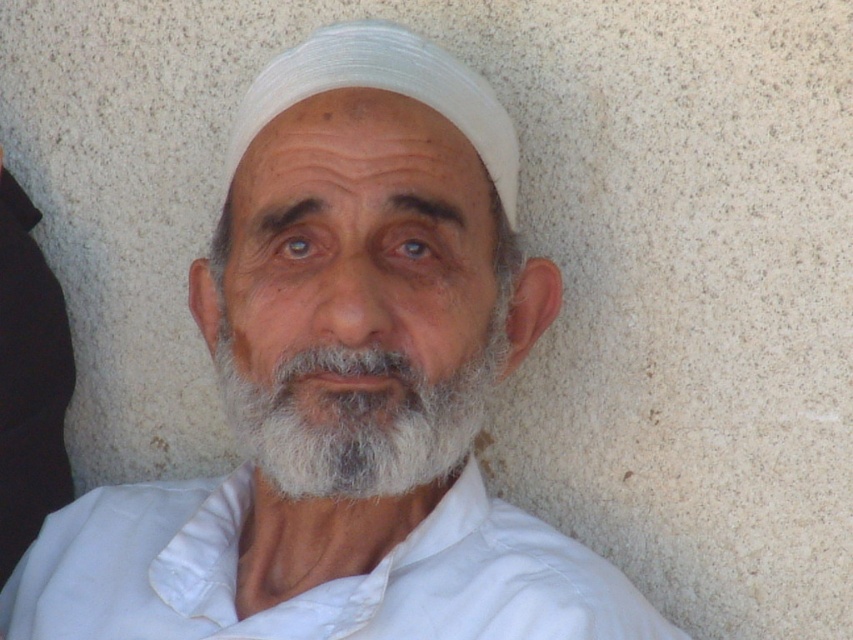
Between point (409, 554) and point (347, 36), which one is positioned behind?

Positioned behind is point (347, 36).

Is white cotton shirt at center to the right of white fabric headscarf at center from the viewer's perspective?

In fact, white cotton shirt at center is to the left of white fabric headscarf at center.

Locate an element on the screen. The image size is (853, 640). white cotton shirt at center is located at coordinates (318, 584).

Does white matte headscarf at center have a lesser height compared to black fabric at left?

Indeed, white matte headscarf at center has a lesser height compared to black fabric at left.

Between white matte headscarf at center and black fabric at left, which one appears on the left side from the viewer's perspective?

Positioned to the left is black fabric at left.

What do you see at coordinates (378, 280) in the screenshot? The height and width of the screenshot is (640, 853). I see `white matte headscarf at center` at bounding box center [378, 280].

This screenshot has width=853, height=640. Identify the location of white matte headscarf at center. (378, 280).

Is white cotton shirt at center behind white soft beard at center?

That is True.

What are the coordinates of `white cotton shirt at center` in the screenshot? It's located at (318, 584).